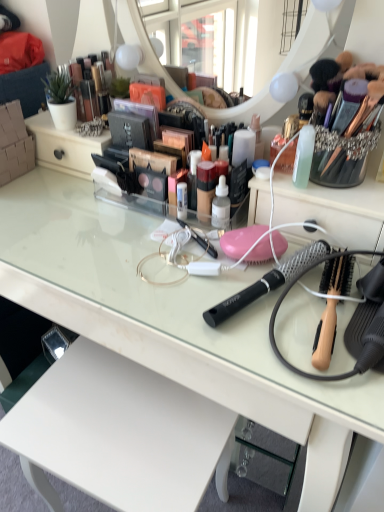
Question: Does point (190, 385) appear closer or farther from the camera than point (77, 95)?

Choices:
 (A) closer
 (B) farther

Answer: (A)

Question: Choose the correct answer: Is clear glass desk at center inside metallic gold makeup at upper left or outside it?

Choices:
 (A) outside
 (B) inside

Answer: (A)

Question: Which of these objects is positioned farthest from the black mesh hairbrush at center, which appears as the second brush when viewed from the right?

Choices:
 (A) metallic gold makeup at upper left
 (B) wooden-handled hairbrush at right, the 2th brush in the left-to-right sequence
 (C) clear glass desk at center

Answer: (A)

Question: Based on their relative distances, which object is nearer to the black mesh hairbrush at center, which appears as the second brush when viewed from the right?

Choices:
 (A) wooden-handled hairbrush at right, the 2th brush in the left-to-right sequence
 (B) metallic gold makeup at upper left
 (C) clear glass desk at center

Answer: (A)